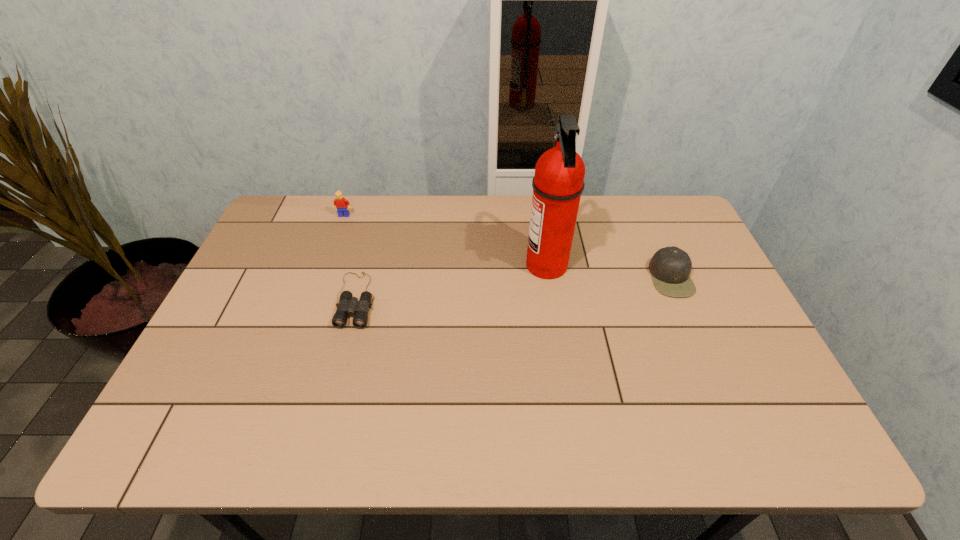
This screenshot has height=540, width=960. What are the coordinates of `free region located 0.370m on the side of the second object from right to left near the handle` in the screenshot? It's located at (403, 266).

You are a GUI agent. You are given a task and a screenshot of the screen. Output one action in this format:
    pyautogui.click(x=<x>, y=<y>)
    Task: Click on the vacant space located on the face of the farthest object
    The height and width of the screenshot is (540, 960).
    Given the screenshot: What is the action you would take?
    pyautogui.click(x=329, y=257)

This screenshot has height=540, width=960. In order to click on vacant space located 0.210m on the brim of the second shortest object in this screenshot , I will do `click(580, 278)`.

Where is `free space located on the brim of the second shortest object`? free space located on the brim of the second shortest object is located at coordinates (533, 278).

The image size is (960, 540). I want to click on vacant space located on the brim of the second shortest object, so click(x=631, y=278).

Identify the location of free space located 0.060m at the eyepiece of the binoculars. (343, 348).

Image resolution: width=960 pixels, height=540 pixels. In order to click on object at the far edge in this screenshot , I will do `click(340, 203)`.

Identify the location of object that is at the right edge. Image resolution: width=960 pixels, height=540 pixels. (670, 267).

The width and height of the screenshot is (960, 540). What are the coordinates of `vacant space at the far edge` in the screenshot? It's located at (425, 212).

In order to click on vacant space at the near edge of the desktop in this screenshot , I will do `click(384, 443)`.